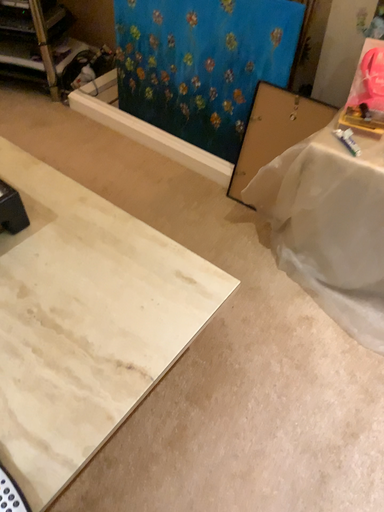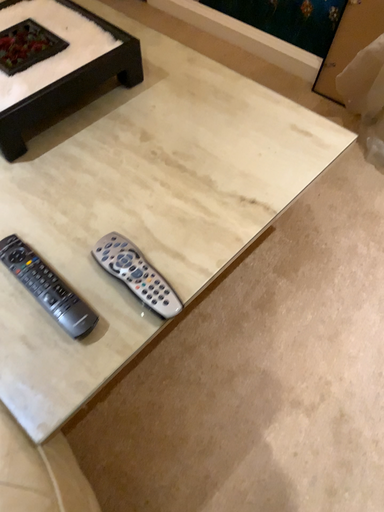
Question: Which way did the camera rotate in the video?

Choices:
 (A) rotated downward
 (B) rotated upward

Answer: (A)